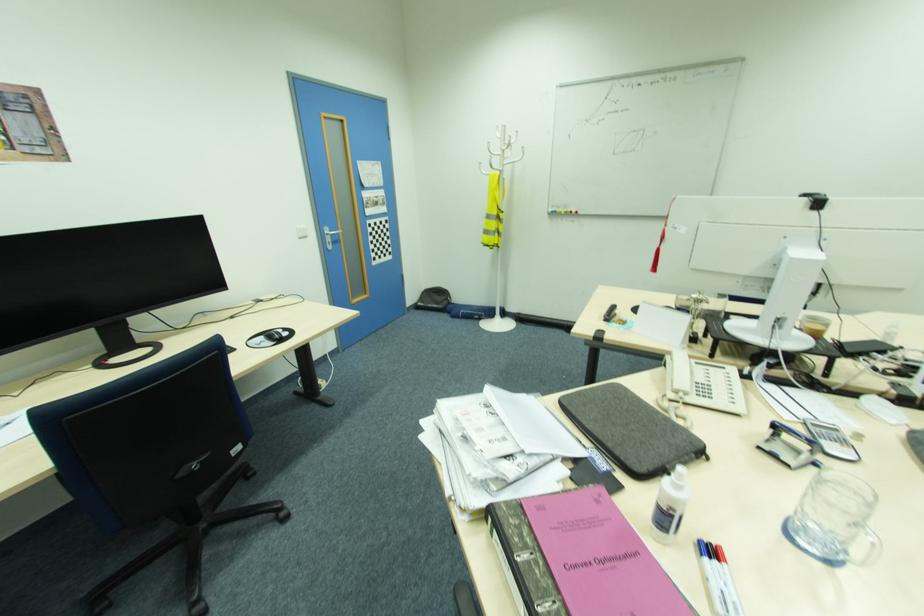
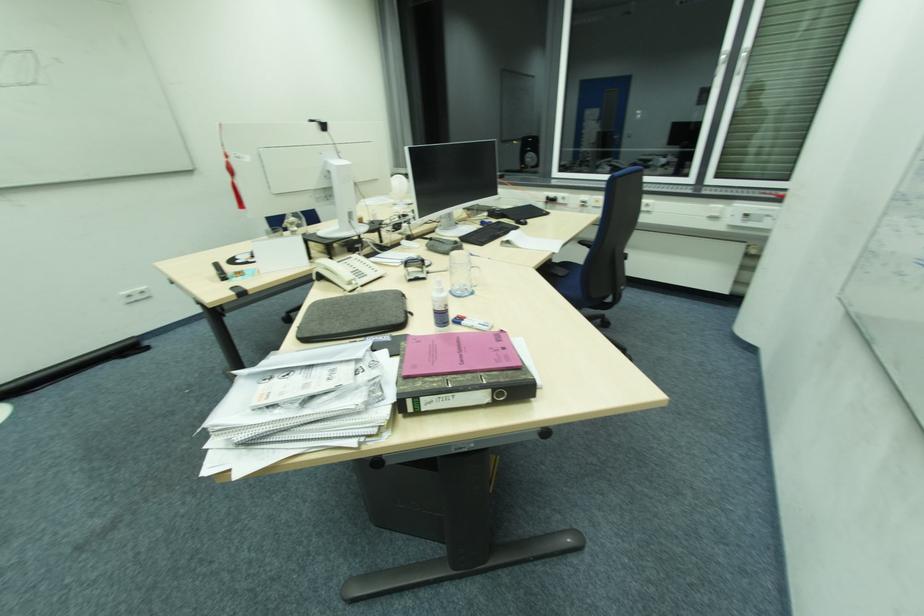
The point at [588,564] is marked in the first image. Where is the corresponding point in the second image?

(465, 357)